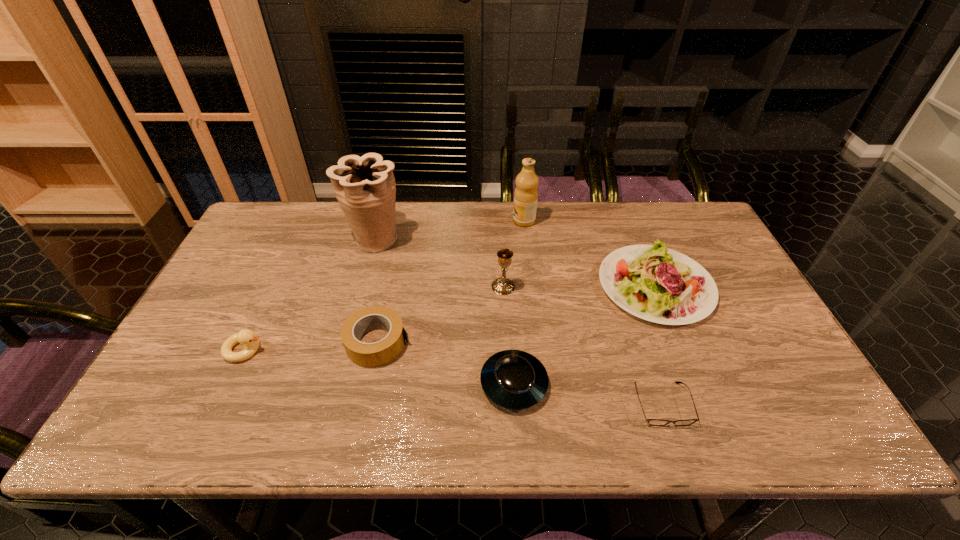
Locate an element on the screen. This screenshot has height=540, width=960. blank region between the urn and the chalice is located at coordinates (439, 263).

Where is `unoccupied position between the salad plate and the shortest object`? unoccupied position between the salad plate and the shortest object is located at coordinates (659, 345).

Locate an element on the screen. This screenshot has height=540, width=960. vacant space that is in between the chalice and the shortest object is located at coordinates (583, 345).

The width and height of the screenshot is (960, 540). In order to click on free space between the chalice and the duct tape in this screenshot , I will do `click(441, 315)`.

Where is `empty space between the spectacles and the chalice`? The height and width of the screenshot is (540, 960). empty space between the spectacles and the chalice is located at coordinates (583, 345).

Identify the location of free space between the saucer and the duct tape. (445, 363).

You are a GUI agent. You are given a task and a screenshot of the screen. Output one action in this format:
    pyautogui.click(x=<x>, y=<y>)
    Task: Click on the vacant area between the urn and the sixth shortest object
    
    Given the screenshot: What is the action you would take?
    (x=439, y=263)

I want to click on vacant area that lies between the urn and the olive oil, so click(449, 230).

The image size is (960, 540). I want to click on free space between the olive oil and the duct tape, so click(x=451, y=282).

Locate an element on the screen. This screenshot has width=960, height=540. object identified as the third closest to the spectacles is located at coordinates (502, 286).